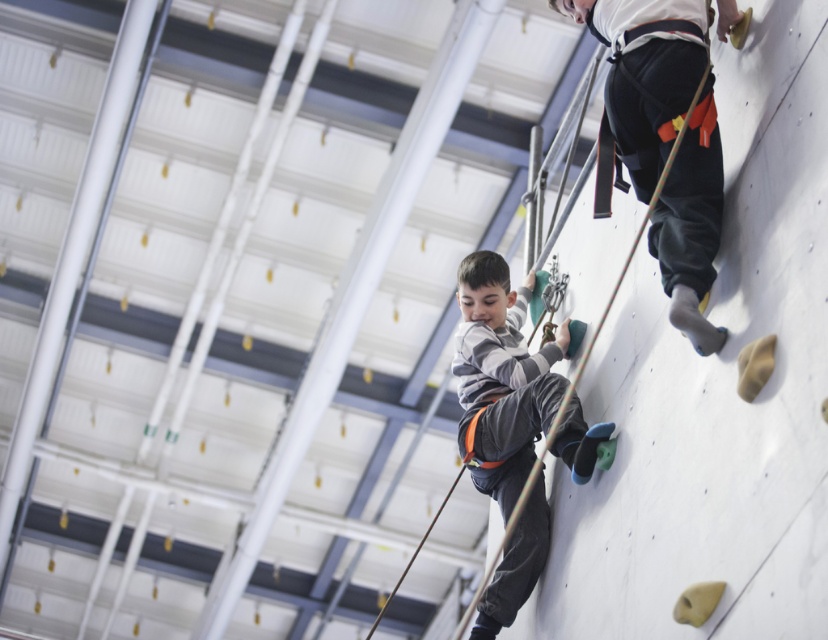
Which is below, black fabric pants at upper right or gray fabric pants at center?

gray fabric pants at center is below.

Between black fabric pants at upper right and gray fabric pants at center, which one appears on the right side from the viewer's perspective?

From the viewer's perspective, black fabric pants at upper right appears more on the right side.

Which is behind, point (668, 198) or point (537, 492)?

Point (537, 492)

Where is `black fabric pants at upper right`? black fabric pants at upper right is located at coordinates (644, 72).